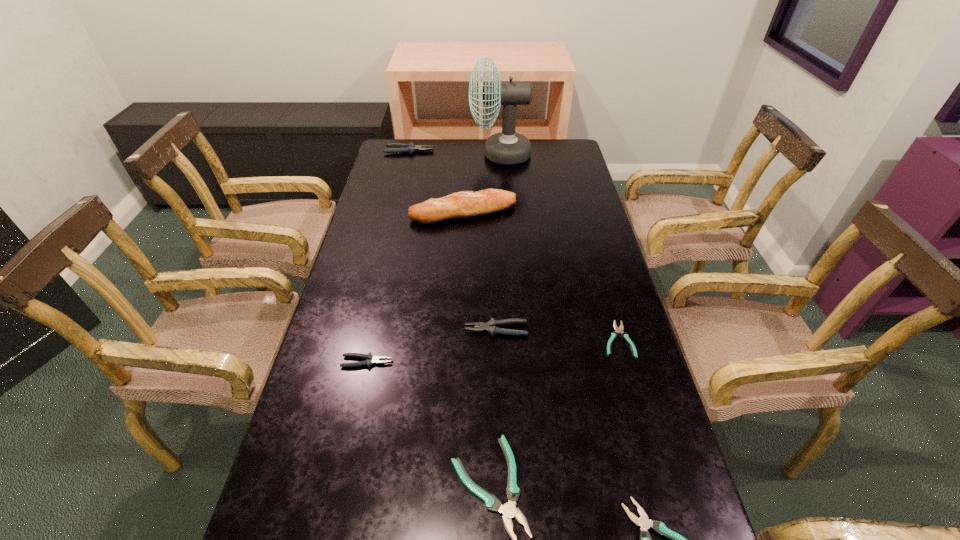
What are the coordinates of `free space that is in between the tallest object and the baguet` in the screenshot? It's located at (482, 183).

Find the location of a particular element. vacant area that lies between the farthest gray pliers and the shortest pliers is located at coordinates (514, 245).

Locate an element on the screen. Image resolution: width=960 pixels, height=540 pixels. free space between the tallest pliers and the tallest object is located at coordinates (455, 153).

I want to click on empty space between the smallest teal pliers and the second tallest object, so pos(540,275).

The image size is (960, 540). What are the coordinates of `vacant area that lies between the shortest pliers and the second smallest gray pliers` in the screenshot? It's located at (557, 334).

Identify which object is located as the fifth nearest to the lightbrown baguet. Please provide its 2D coordinates. Your answer should be formatted as a tuple, i.e. [(x, y)], where the tuple contains the x and y coordinates of a point satisfying the conditions above.

[(370, 359)]

The width and height of the screenshot is (960, 540). I want to click on object that stands as the sixth closest to the nearest gray pliers, so click(507, 147).

Where is `pliers that is the fifth nearest to the second shortest pliers`? pliers that is the fifth nearest to the second shortest pliers is located at coordinates (396, 147).

Identify which pliers is located as the fifth nearest to the tallest object. Please provide its 2D coordinates. Your answer should be formatted as a tuple, i.e. [(x, y)], where the tuple contains the x and y coordinates of a point satisfying the conditions above.

[(509, 511)]

Select which gray pliers is the closest to the smallest gray pliers. Please provide its 2D coordinates. Your answer should be formatted as a tuple, i.e. [(x, y)], where the tuple contains the x and y coordinates of a point satisfying the conditions above.

[(491, 326)]